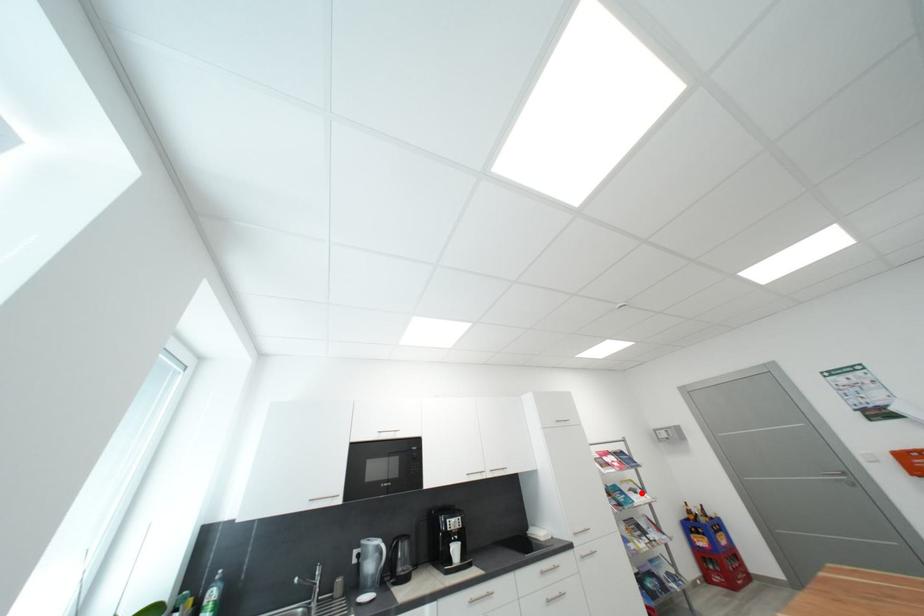
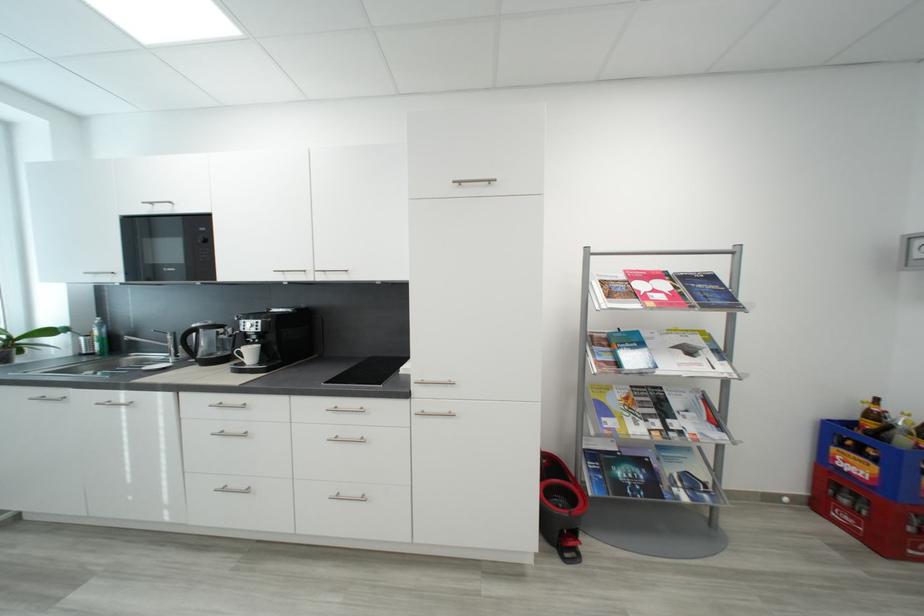
Locate, in the second image, the point that corresponds to the highlighted location in the first image.

(697, 353)